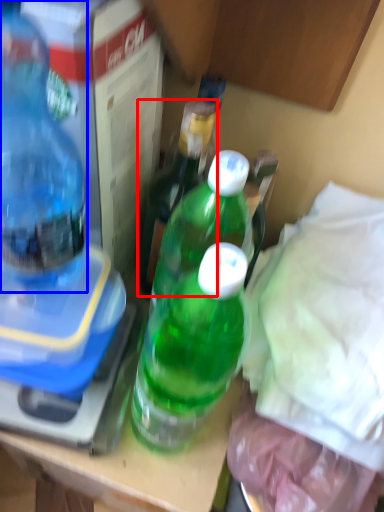
Question: Among these objects, which one is farthest to the camera, bottle (highlighted by a red box) or bottle (highlighted by a blue box)?

Choices:
 (A) bottle
 (B) bottle

Answer: (A)